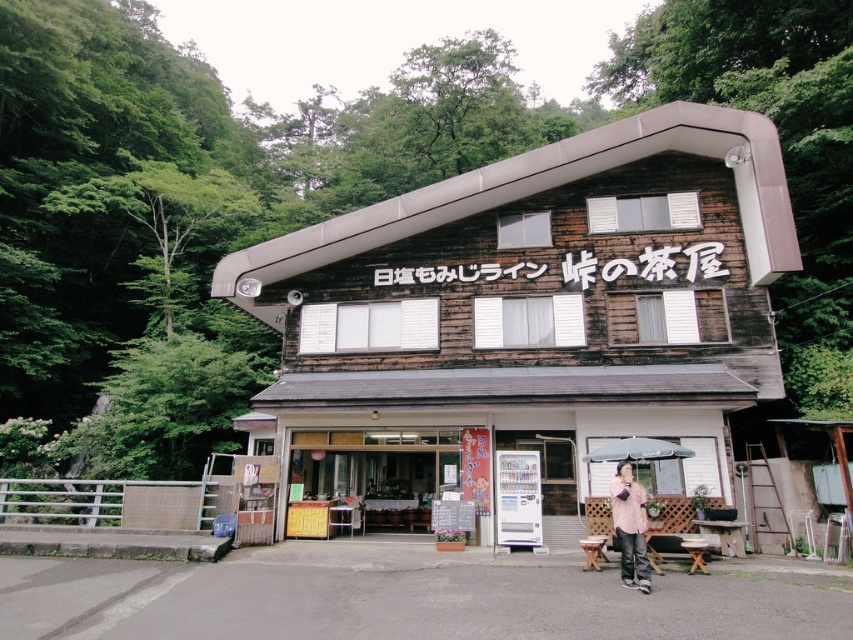
Question: Does weathered wood store at center appear over pink fabric jacket at lower right?

Choices:
 (A) yes
 (B) no

Answer: (A)

Question: Is weathered wood store at center bigger than pink fabric jacket at lower right?

Choices:
 (A) yes
 (B) no

Answer: (A)

Question: Among these objects, which one is nearest to the camera?

Choices:
 (A) pink fabric jacket at lower right
 (B) weathered wood store at center

Answer: (A)

Question: Can you confirm if weathered wood store at center is smaller than pink fabric jacket at lower right?

Choices:
 (A) yes
 (B) no

Answer: (B)

Question: Which of the following is the closest to the observer?

Choices:
 (A) pink fabric jacket at lower right
 (B) weathered wood store at center

Answer: (A)